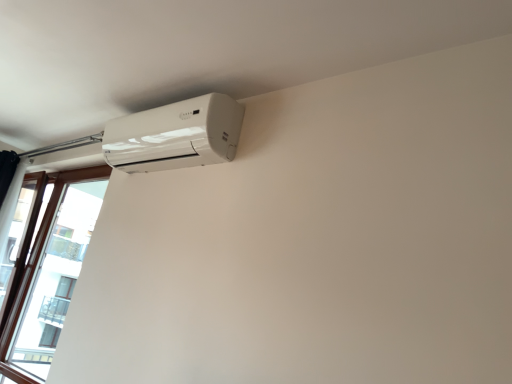
The height and width of the screenshot is (384, 512). Identify the location of white glossy air conditioner at upper left. (175, 135).

This screenshot has height=384, width=512. Describe the element at coordinates (175, 135) in the screenshot. I see `white glossy air conditioner at upper left` at that location.

What is the approximate width of brown wooden window at left?

brown wooden window at left is 9.43 inches in width.

Where is `brown wooden window at left`? The image size is (512, 384). brown wooden window at left is located at coordinates (38, 270).

Describe the element at coordinates (38, 270) in the screenshot. I see `brown wooden window at left` at that location.

The height and width of the screenshot is (384, 512). I want to click on white glossy air conditioner at upper left, so click(175, 135).

Can you confirm if white glossy air conditioner at upper left is positioned to the left of brown wooden window at left?

No.

From the picture: Is white glossy air conditioner at upper left positioned before brown wooden window at left?

That is True.

Is point (174, 160) closer to camera compared to point (52, 228)?

Yes, point (174, 160) is closer to viewer.

From the image's perspective, which is above, white glossy air conditioner at upper left or brown wooden window at left?

From the image's view, white glossy air conditioner at upper left is above.

From a real-world perspective, who is located higher, white glossy air conditioner at upper left or brown wooden window at left?

From a 3D spatial view, white glossy air conditioner at upper left is above.

Considering the relative sizes of white glossy air conditioner at upper left and brown wooden window at left in the image provided, is white glossy air conditioner at upper left wider than brown wooden window at left?

No.

Considering the sizes of white glossy air conditioner at upper left and brown wooden window at left in the image, is white glossy air conditioner at upper left taller or shorter than brown wooden window at left?

In the image, white glossy air conditioner at upper left appears to be shorter than brown wooden window at left.

Who is smaller, white glossy air conditioner at upper left or brown wooden window at left?

Smaller between the two is white glossy air conditioner at upper left.

Would you say brown wooden window at left is part of white glossy air conditioner at upper left's contents?

Definitely not — brown wooden window at left is not inside white glossy air conditioner at upper left.

Is white glossy air conditioner at upper left touching brown wooden window at left?

No, white glossy air conditioner at upper left is not next to brown wooden window at left.

Is white glossy air conditioner at upper left aimed at brown wooden window at left?

No, white glossy air conditioner at upper left is not facing towards brown wooden window at left.

Find the location of a particular element. window on the left side of white glossy air conditioner at upper left is located at coordinates (38, 270).

Is brown wooden window at left at the right side of white glossy air conditioner at upper left?

Incorrect, brown wooden window at left is not on the right side of white glossy air conditioner at upper left.

In the scene shown: Does brown wooden window at left come in front of white glossy air conditioner at upper left?

No, it is not.

Considering the positions of point (36, 278) and point (179, 166), is point (36, 278) closer or farther from the camera than point (179, 166)?

Point (36, 278) is positioned farther from the camera compared to point (179, 166).

From the image's perspective, between brown wooden window at left and white glossy air conditioner at upper left, which one is located above?

white glossy air conditioner at upper left appears higher in the image.

From a real-world perspective, does brown wooden window at left sit lower than white glossy air conditioner at upper left?

Yes, from a real-world perspective, brown wooden window at left is below white glossy air conditioner at upper left.

Is brown wooden window at left thinner than white glossy air conditioner at upper left?

Incorrect, the width of brown wooden window at left is not less than that of white glossy air conditioner at upper left.

Who is taller, brown wooden window at left or white glossy air conditioner at upper left?

With more height is brown wooden window at left.

Can you confirm if brown wooden window at left is bigger than white glossy air conditioner at upper left?

Yes, brown wooden window at left is bigger than white glossy air conditioner at upper left.

Based on the photo, is brown wooden window at left inside the boundaries of white glossy air conditioner at upper left, or outside?

brown wooden window at left is outside white glossy air conditioner at upper left.

Looking at this image, is brown wooden window at left far away from white glossy air conditioner at upper left?

brown wooden window at left is positioned a significant distance from white glossy air conditioner at upper left.

Is brown wooden window at left looking in the opposite direction of white glossy air conditioner at upper left?

brown wooden window at left is not turned away from white glossy air conditioner at upper left.

This screenshot has width=512, height=384. In order to click on window beneath the white glossy air conditioner at upper left (from a real-world perspective) in this screenshot , I will do `click(38, 270)`.

The image size is (512, 384). In order to click on home appliance that appears on the right of brown wooden window at left in this screenshot , I will do `click(175, 135)`.

Identify the location of window that is below the white glossy air conditioner at upper left (from the image's perspective). The height and width of the screenshot is (384, 512). (38, 270).